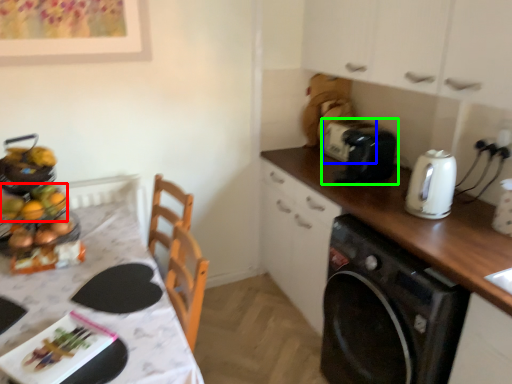
Question: Considering the real-world distances, which object is farthest from food (highlighted by a red box)? appliance (highlighted by a blue box) or toaster (highlighted by a green box)?

Choices:
 (A) appliance
 (B) toaster

Answer: (A)